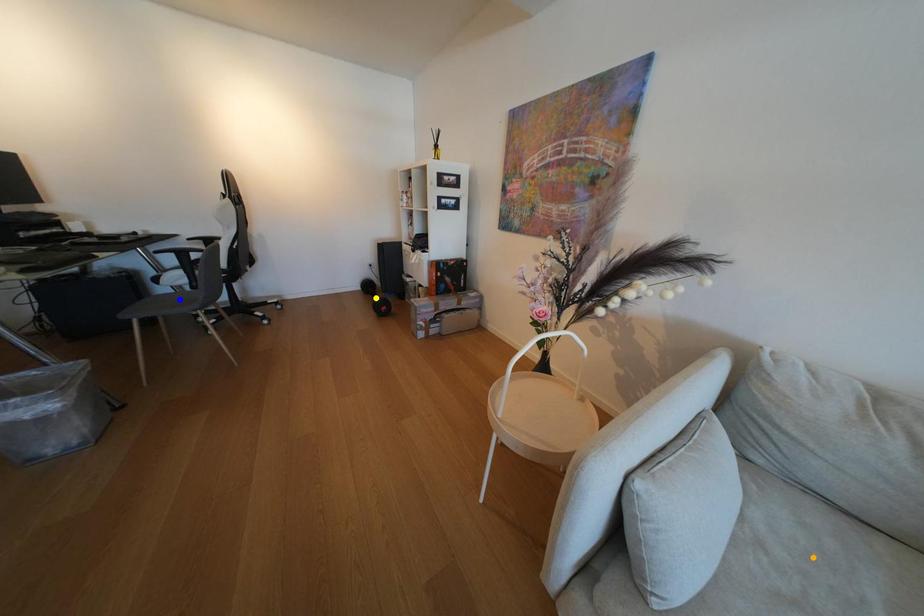
Order these from nearest to farthest:
1. yellow point
2. blue point
3. orange point

1. orange point
2. blue point
3. yellow point